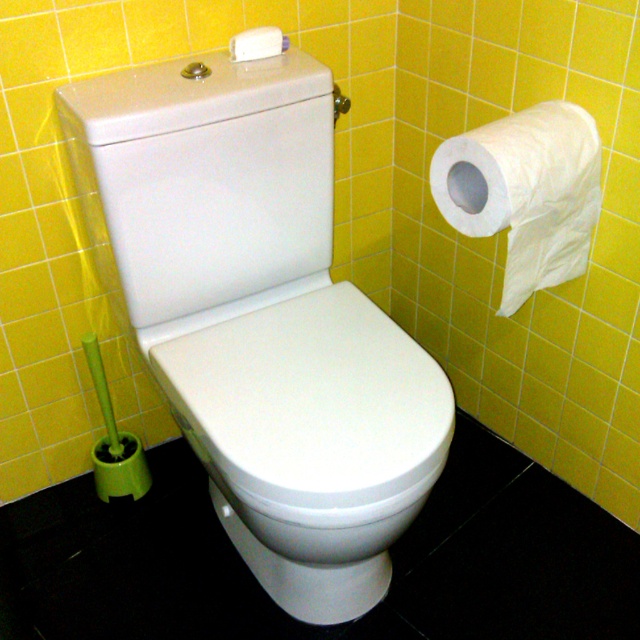
You are a guest in this bathroom and need to choose between the white paper at upper right and the white matte tissue at upper center for your use. Which one is larger in size?

The white paper at upper right is bigger than the white matte tissue at upper center, so you should choose the white paper at upper right if you need a larger option.

You are a guest in this bathroom and need to grab both the white paper at upper right and the white matte tissue at upper center. Which one do you need to reach higher to get?

The white paper at upper right is taller than the white matte tissue at upper center, so you need to reach higher to get the white paper at upper right.